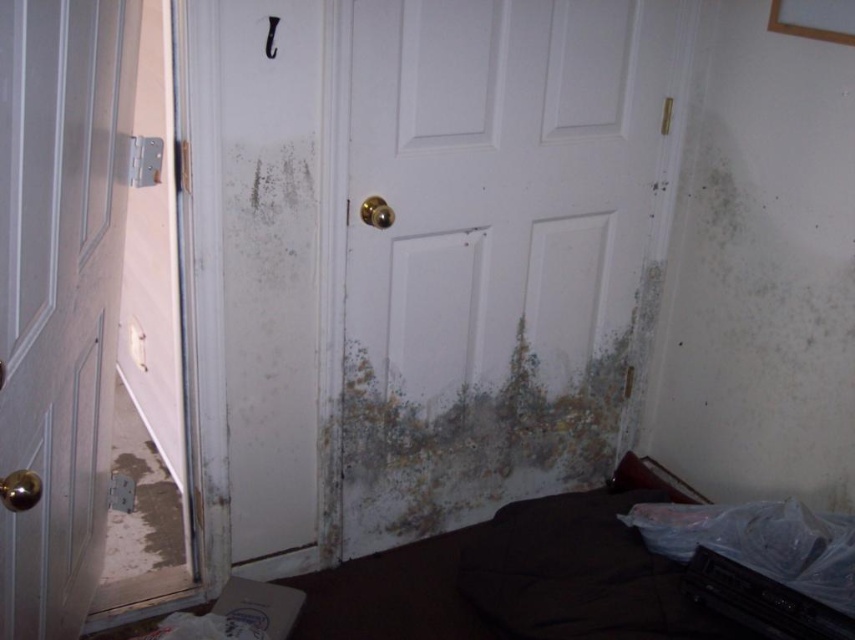
Who is taller, white matte door at center or white matte door at left?

white matte door at center

Who is shorter, white matte door at center or white matte door at left?

white matte door at left

Identify the location of white matte door at center. (498, 248).